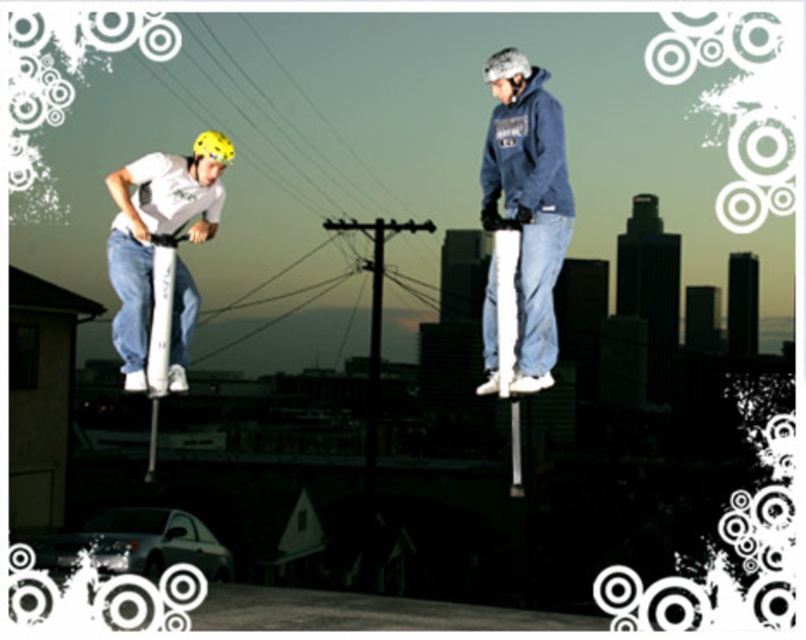
Question: Which of the following is the closest to the observer?

Choices:
 (A) (507, 60)
 (B) (144, 193)
 (C) (496, 84)

Answer: (A)

Question: Which of the following is the closest to the observer?

Choices:
 (A) denim jeans at center
 (B) white matte pogo stick at left
 (C) silver metallic helmet at upper right
 (D) yellow matte helmet at left

Answer: (A)

Question: Can you confirm if denim jeans at center is thinner than yellow matte helmet at left?

Choices:
 (A) yes
 (B) no

Answer: (A)

Question: Which object is the closest to the silver metallic helmet at upper right?

Choices:
 (A) white matte pogo stick at left
 (B) yellow matte helmet at left
 (C) denim jeans at center

Answer: (C)

Question: Does white matte pogo stick at left appear on the right side of silver metallic helmet at upper right?

Choices:
 (A) no
 (B) yes

Answer: (A)

Question: Can you confirm if white matte pogo stick at left is positioned to the left of yellow matte helmet at left?

Choices:
 (A) yes
 (B) no

Answer: (A)